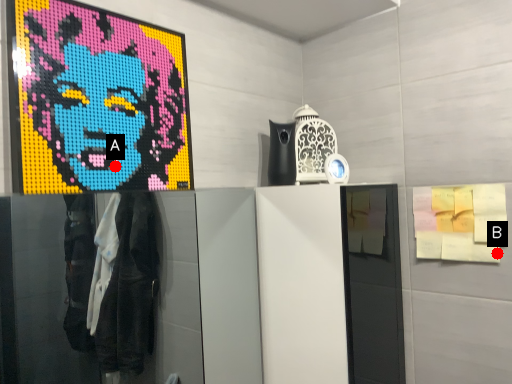
Question: Two points are circled on the image, labeled by A and B beside each circle. Which point is closer to the camera?

Choices:
 (A) A is closer
 (B) B is closer

Answer: (A)